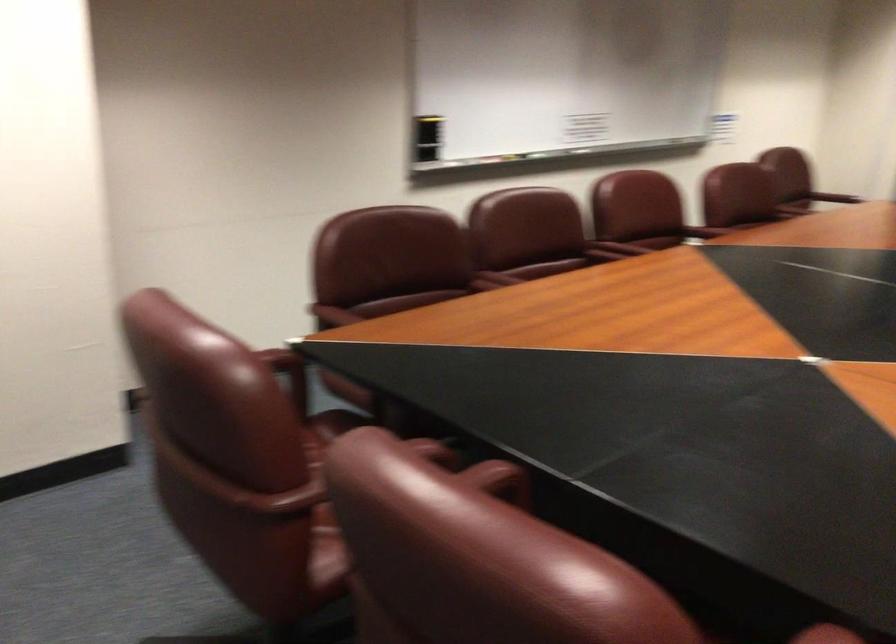
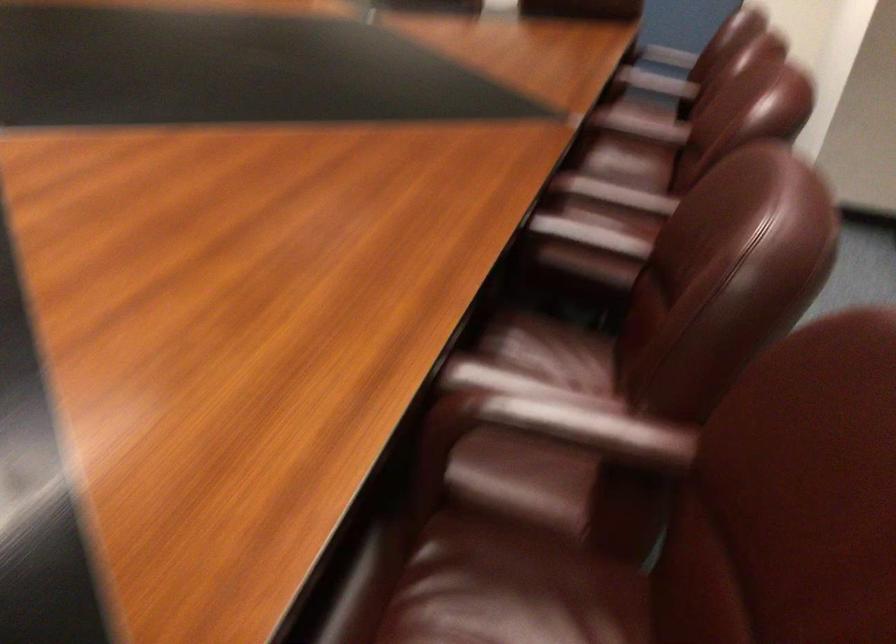
Locate, in the second image, the point that corresponds to point 529,281 in the first image.

(656, 82)